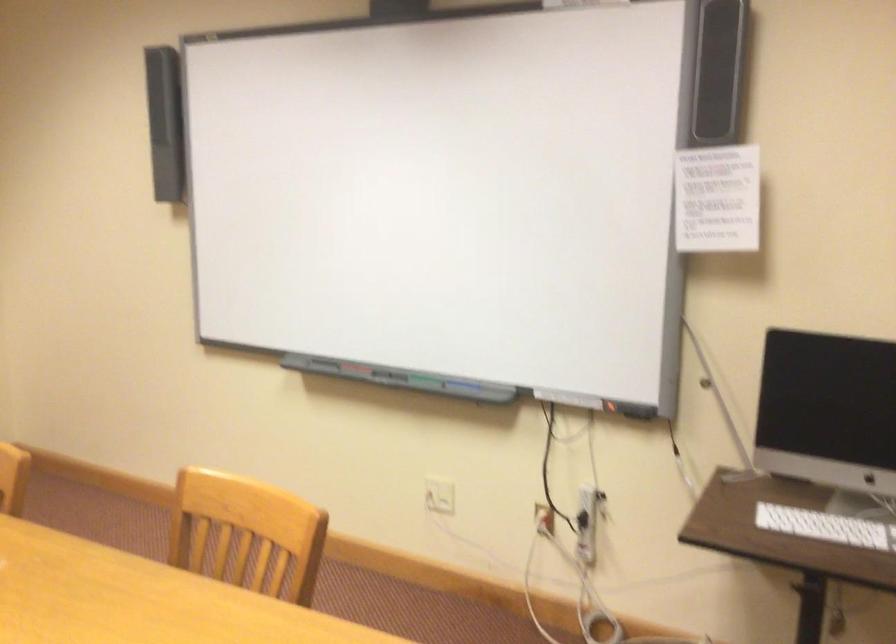
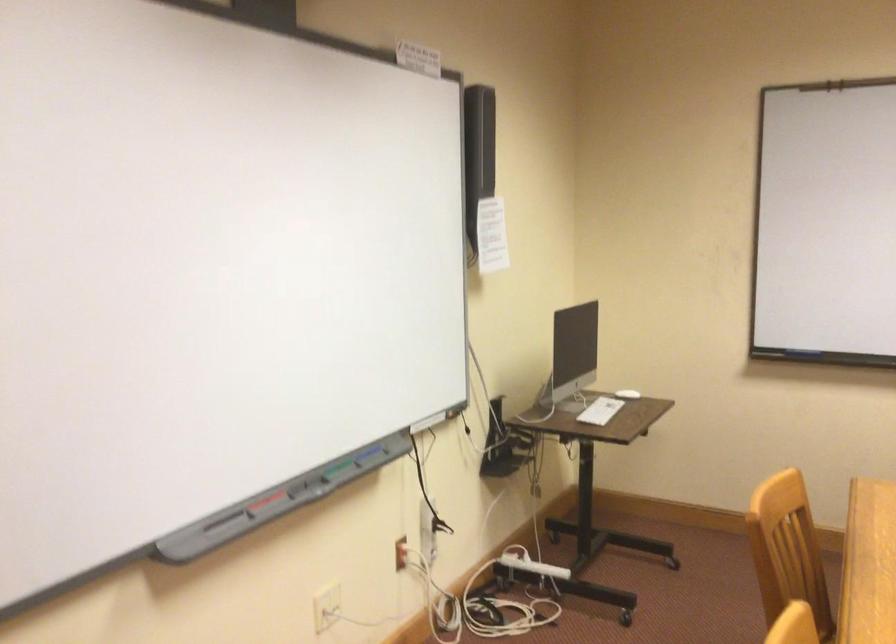
Where in the second image is the point corresponding to [395,375] from the first image?

(302, 484)